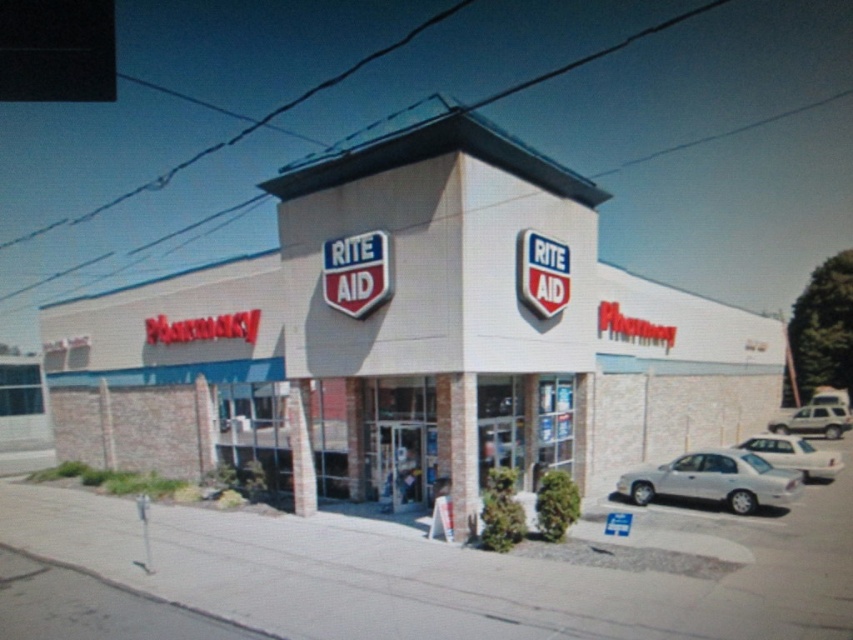
You are a delivery person approaching the Rite Aid pharmacy store. You need to park your vehicle between the silver metallic sedan at lower right and the white matte suv at right. Is there enough space between them to park your standard size delivery van?

The silver metallic sedan at lower right is to the left of the white matte suv at right. Since the distance between them isn not specified, it is uncertain if there is enough space to park a standard size delivery van between them.

You are standing at the corner intersection near the Rite Aid pharmacy. You see a white brick building at center and a white matte suv at right. Which object is closer to you?

The white brick building at center is closer to you because it is in front of the white matte suv at right.